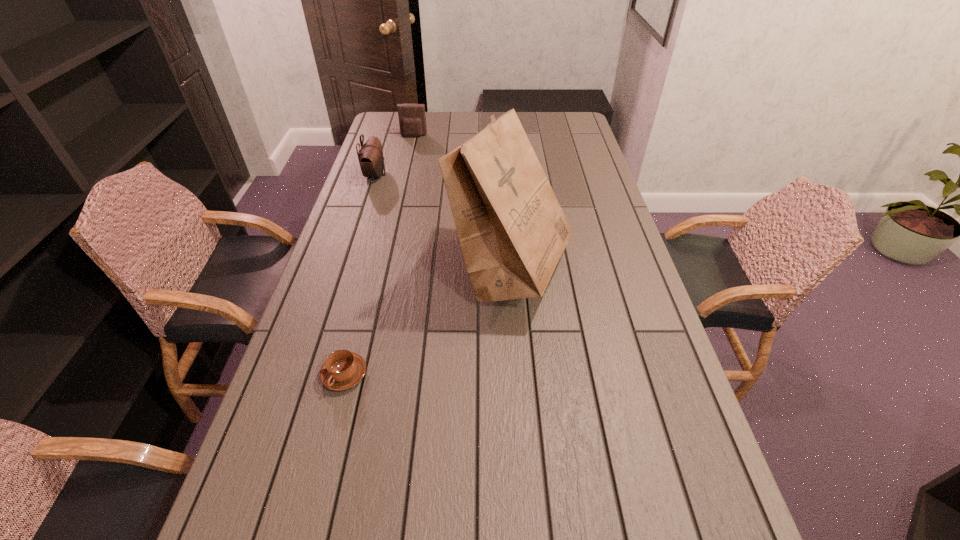
At what (x,y) coordinates should I click in order to perform the action: click on free location located with an open flap on the farther pouch. Please return your answer as a coordinate pair (x, y). Looking at the image, I should click on (407, 166).

You are a GUI agent. You are given a task and a screenshot of the screen. Output one action in this format:
    pyautogui.click(x=<x>, y=<y>)
    Task: Click on the vacant space located 0.050m on the side of the shortest object with the handle
    The width and height of the screenshot is (960, 540).
    Given the screenshot: What is the action you would take?
    pyautogui.click(x=334, y=415)

Find the location of a particular element. Image resolution: width=960 pixels, height=540 pixels. object at the far edge is located at coordinates (412, 120).

Locate an element on the screen. The image size is (960, 540). cappuccino that is positioned at the left edge is located at coordinates (342, 370).

Locate an element on the screen. The width and height of the screenshot is (960, 540). object present at the far left corner is located at coordinates pyautogui.click(x=412, y=120).

Find the location of a particular element. The height and width of the screenshot is (540, 960). free space at the left edge of the desktop is located at coordinates (291, 397).

Locate an element on the screen. vacant space at the right edge is located at coordinates (589, 305).

The image size is (960, 540). I want to click on free space at the far left corner, so click(x=388, y=118).

The image size is (960, 540). I want to click on free space between the second farthest object and the third farthest object, so click(x=443, y=222).

Identify the location of free space between the rightmost object and the shortest object. The image size is (960, 540). (427, 322).